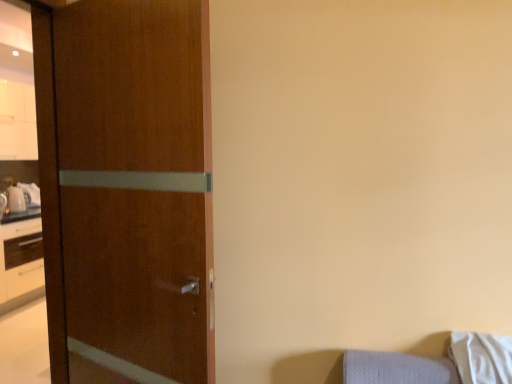
This screenshot has height=384, width=512. What do you see at coordinates (127, 189) in the screenshot?
I see `wooden door at left` at bounding box center [127, 189].

What are the coordinates of `wooden door at left` in the screenshot? It's located at (127, 189).

I want to click on white soft pillow at lower right, so click(482, 357).

What do you see at coordinates (482, 357) in the screenshot? The width and height of the screenshot is (512, 384). I see `white soft pillow at lower right` at bounding box center [482, 357].

Where is `wooden door at left`? This screenshot has height=384, width=512. wooden door at left is located at coordinates (127, 189).

Based on the photo, does white soft pillow at lower right appear on the right side of wooden door at left?

Indeed, white soft pillow at lower right is positioned on the right side of wooden door at left.

Considering the relative positions of white soft pillow at lower right and wooden door at left in the image provided, is white soft pillow at lower right in front of wooden door at left?

No.

Does point (465, 359) come behind point (124, 218)?

That is False.

From the image's perspective, relative to wooden door at left, is white soft pillow at lower right above or below?

Based on their image positions, white soft pillow at lower right is located beneath wooden door at left.

From a real-world perspective, does white soft pillow at lower right sit lower than wooden door at left?

Correct, in the physical world, white soft pillow at lower right is lower than wooden door at left.

From the picture: Between white soft pillow at lower right and wooden door at left, which one has larger width?

white soft pillow at lower right.

Looking at this image, is white soft pillow at lower right taller than wooden door at left?

Incorrect, the height of white soft pillow at lower right is not larger of that of wooden door at left.

Which of these two, white soft pillow at lower right or wooden door at left, is bigger?

wooden door at left is bigger.

Is white soft pillow at lower right situated inside wooden door at left or outside?

white soft pillow at lower right lies outside wooden door at left.

Can you see white soft pillow at lower right touching wooden door at left?

No, white soft pillow at lower right is not beside wooden door at left.

Is wooden door at left at the back of white soft pillow at lower right?

That's not correct — white soft pillow at lower right is not looking away from wooden door at left.

How different are the orientations of white soft pillow at lower right and wooden door at left in degrees?

21.6 degrees.

Measure the distance between white soft pillow at lower right and wooden door at left.

white soft pillow at lower right is 4.22 feet away from wooden door at left.

You are a GUI agent. You are given a task and a screenshot of the screen. Output one action in this format:
    pyautogui.click(x=<x>, y=<y>)
    Task: Click on the door above the white soft pillow at lower right (from a real-world perspective)
    
    Given the screenshot: What is the action you would take?
    pyautogui.click(x=127, y=189)

Considering the relative positions of wooden door at left and white soft pillow at lower right in the image provided, is wooden door at left to the left or to the right of white soft pillow at lower right?

wooden door at left is to the left of white soft pillow at lower right.

Based on the photo, is wooden door at left further to camera compared to white soft pillow at lower right?

No, wooden door at left is closer to the viewer.

Which is closer to the camera, (172,261) or (459,370)?

The point (172,261) is more forward.

From the image's perspective, is wooden door at left under white soft pillow at lower right?

Incorrect, from the image's perspective, wooden door at left is higher than white soft pillow at lower right.

From a real-world perspective, does wooden door at left sit lower than white soft pillow at lower right?

No.

Considering the relative sizes of wooden door at left and white soft pillow at lower right in the image provided, is wooden door at left thinner than white soft pillow at lower right?

Correct, the width of wooden door at left is less than that of white soft pillow at lower right.

From their relative heights in the image, would you say wooden door at left is taller or shorter than white soft pillow at lower right?

Considering their sizes, wooden door at left has more height than white soft pillow at lower right.

Who is smaller, wooden door at left or white soft pillow at lower right?

Smaller between the two is white soft pillow at lower right.

Can we say wooden door at left lies outside white soft pillow at lower right?

wooden door at left is positioned outside white soft pillow at lower right.

From the picture: Is wooden door at left far away from white soft pillow at lower right?

That's right, there is a large distance between wooden door at left and white soft pillow at lower right.

Is wooden door at left turned away from white soft pillow at lower right?

No, wooden door at left is not facing the opposite direction of white soft pillow at lower right.

You are a GUI agent. You are given a task and a screenshot of the screen. Output one action in this format:
    pyautogui.click(x=<x>, y=<y>)
    Task: Click on the door in front of the white soft pillow at lower right
    Image resolution: width=512 pixels, height=384 pixels.
    Given the screenshot: What is the action you would take?
    pyautogui.click(x=127, y=189)

Find the location of a particular element. The image size is (512, 384). pillow on the right side of wooden door at left is located at coordinates (482, 357).

Where is `pillow behind the wooden door at left`? pillow behind the wooden door at left is located at coordinates (482, 357).